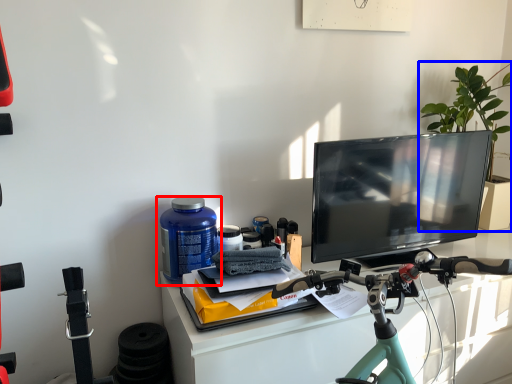
Question: Which object appears closest to the camera in this image, bottle (highlighted by a red box) or houseplant (highlighted by a blue box)?

Choices:
 (A) bottle
 (B) houseplant

Answer: (A)